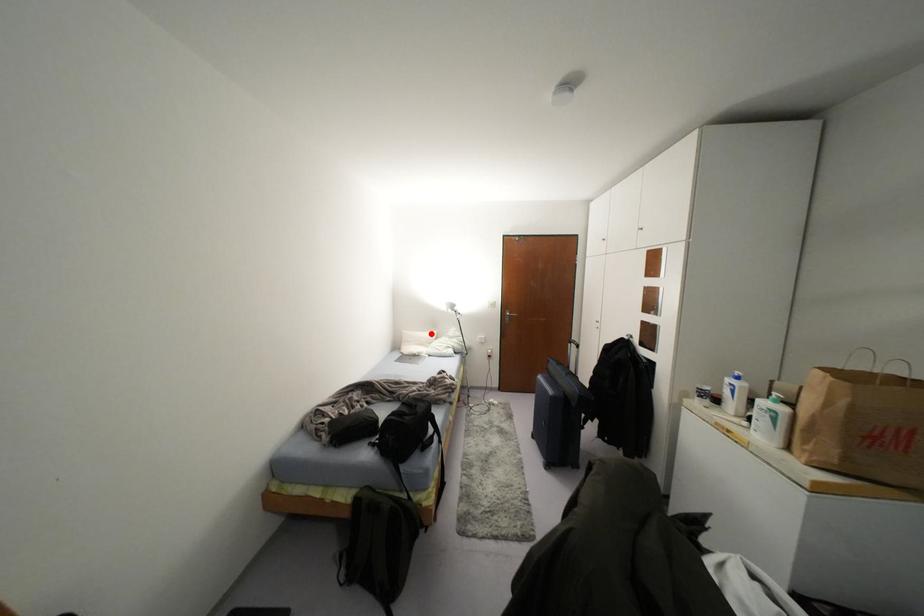
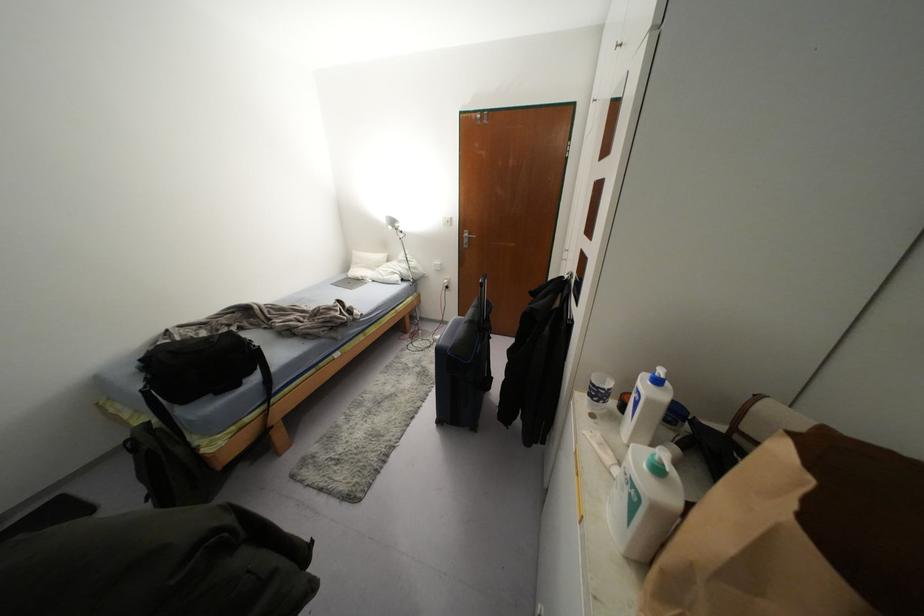
Question: I am providing you with two images of the same scene from different viewpoints. In image1, a red point is highlighted. Considering the same 3D point in image2, which of the following is correct?

Choices:
 (A) It is closer
 (B) It is farther

Answer: (A)